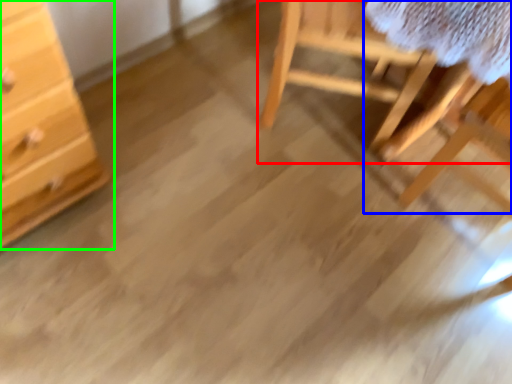
Question: Which object is the closest to the furniture (highlighted by a red box)? Choose among these: table (highlighted by a blue box) or chest of drawers (highlighted by a green box).

Choices:
 (A) table
 (B) chest of drawers

Answer: (A)